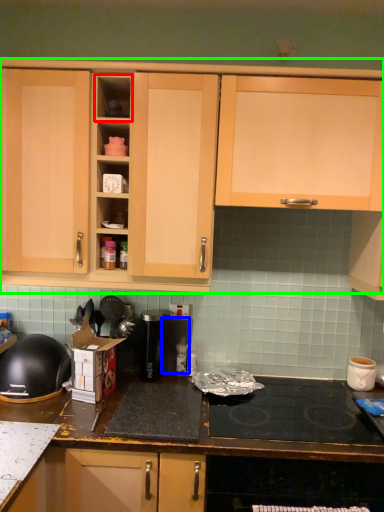
Question: Which object is positioned farthest from shelf (highlighted by a red box)? Select from appliance (highlighted by a blue box) and cabinetry (highlighted by a green box).

Choices:
 (A) appliance
 (B) cabinetry

Answer: (A)